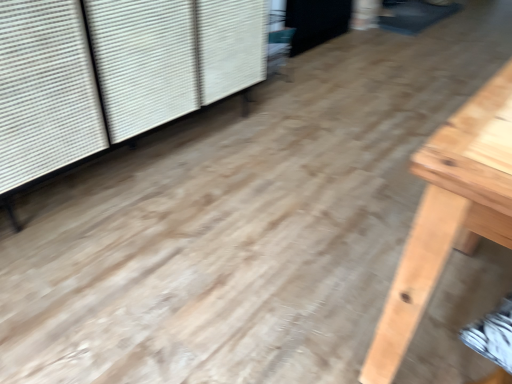
Question: Is white textured shutter at upper left to the left or to the right of black matte screen door at upper center in the image?

Choices:
 (A) left
 (B) right

Answer: (A)

Question: From a real-world perspective, relative to black matte screen door at upper center, is white textured shutter at upper left vertically above or below?

Choices:
 (A) above
 (B) below

Answer: (A)

Question: From the image's perspective, relative to black matte screen door at upper center, is white textured shutter at upper left above or below?

Choices:
 (A) below
 (B) above

Answer: (A)

Question: Considering the positions of black matte screen door at upper center and white textured shutter at upper left in the image, is black matte screen door at upper center bigger or smaller than white textured shutter at upper left?

Choices:
 (A) small
 (B) big

Answer: (A)

Question: Considering the positions of black matte screen door at upper center and white textured shutter at upper left in the image, is black matte screen door at upper center wider or thinner than white textured shutter at upper left?

Choices:
 (A) wide
 (B) thin

Answer: (B)

Question: From their relative heights in the image, would you say black matte screen door at upper center is taller or shorter than white textured shutter at upper left?

Choices:
 (A) tall
 (B) short

Answer: (B)

Question: Considering their positions, is black matte screen door at upper center located in front of or behind white textured shutter at upper left?

Choices:
 (A) front
 (B) behind

Answer: (B)